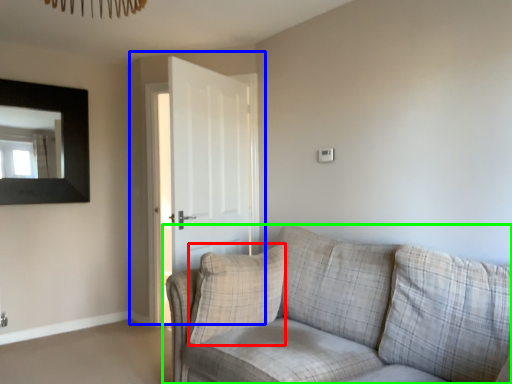
Question: Based on their relative distances, which object is nearer to pillow (highlighted by a red box)? Choose from door (highlighted by a blue box) and studio couch (highlighted by a green box).

Choices:
 (A) door
 (B) studio couch

Answer: (B)